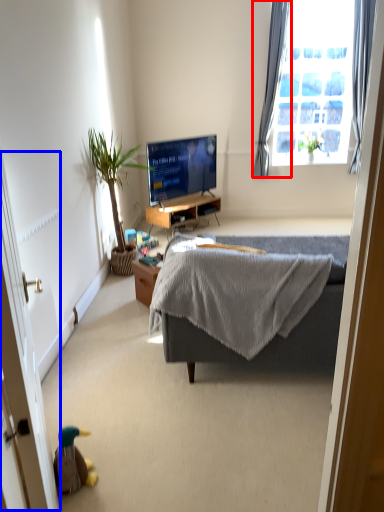
Question: Which object is further to the camera taking this photo, curtain (highlighted by a red box) or screen door (highlighted by a blue box)?

Choices:
 (A) curtain
 (B) screen door

Answer: (A)